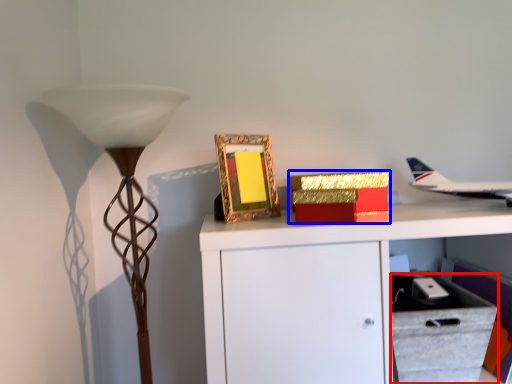
Question: Which point is closer to the camera, drawer (highlighted by a red box) or box (highlighted by a blue box)?

Choices:
 (A) drawer
 (B) box

Answer: (A)